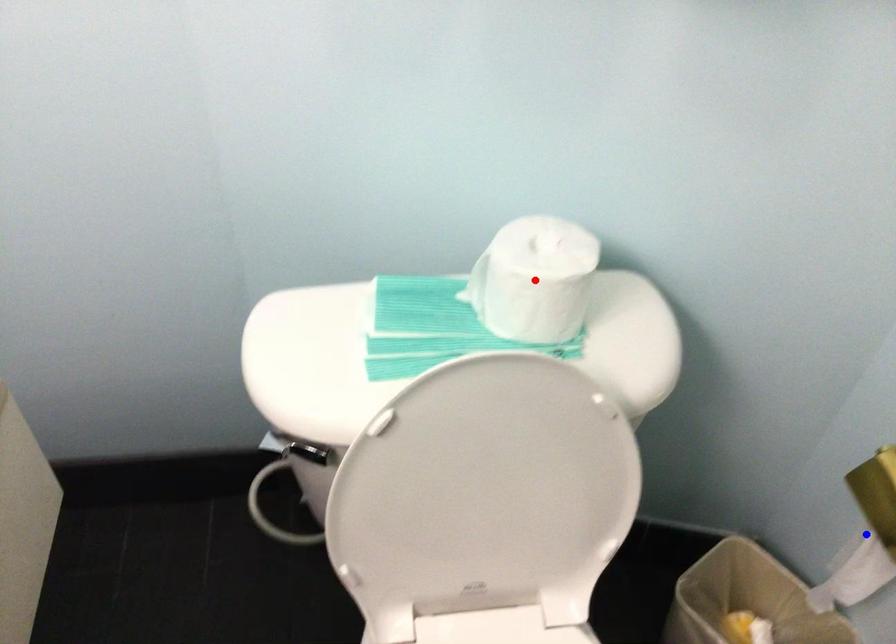
Question: In the image, two points are highlighted. Which point is nearer to the camera? Reply with the corresponding letter.

Choices:
 (A) blue point
 (B) red point

Answer: (B)